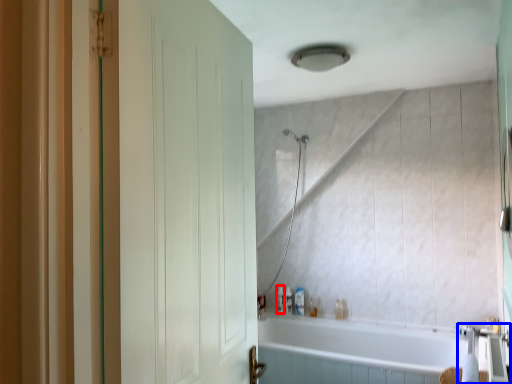
Question: Among these objects, which one is nearest to the camera, toiletry (highlighted by a red box) or faucet (highlighted by a blue box)?

Choices:
 (A) toiletry
 (B) faucet

Answer: (B)